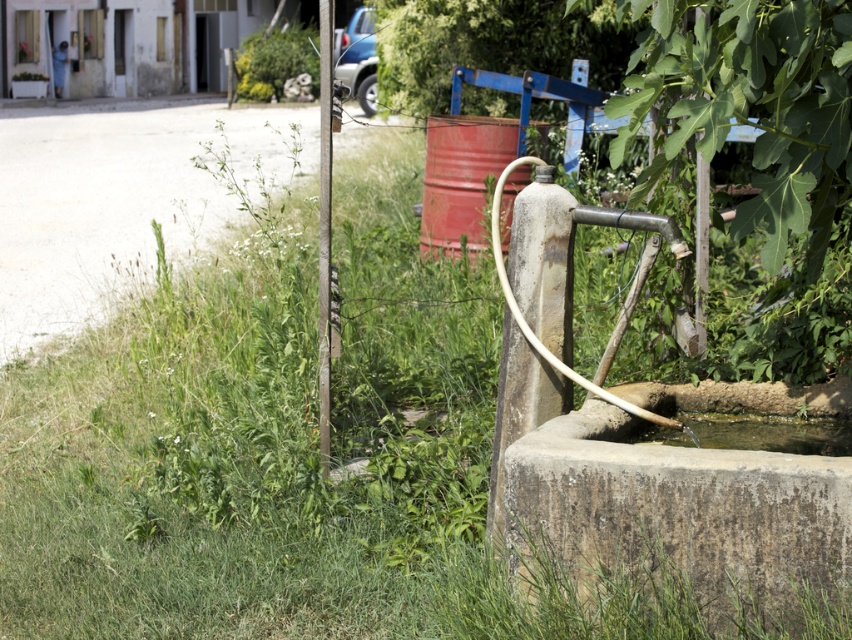
Does gray concrete fountain at lower right appear over rusty metal barrel at center?

No, gray concrete fountain at lower right is not above rusty metal barrel at center.

Does point (617, 522) lie in front of point (430, 170)?

Yes, it is in front of point (430, 170).

Describe the element at coordinates (678, 518) in the screenshot. I see `gray concrete fountain at lower right` at that location.

In order to click on gray concrete fountain at lower right in this screenshot , I will do `click(678, 518)`.

Can you confirm if gray concrete fountain at lower right is thinner than clear water at lower center?

Incorrect, gray concrete fountain at lower right's width is not less than clear water at lower center's.

Measure the distance from gray concrete fountain at lower right to clear water at lower center.

gray concrete fountain at lower right is 15.87 inches away from clear water at lower center.

Measure the distance between point [607,541] and camera.

Point [607,541] is 4.27 meters away from camera.

Find the location of a particular element. gray concrete fountain at lower right is located at coordinates (678, 518).

Does rusty metal barrel at center have a smaller size compared to clear water at lower center?

Actually, rusty metal barrel at center might be larger than clear water at lower center.

Between point (465, 204) and point (802, 419), which one is positioned behind?

The point (465, 204) is more distant.

What are the coordinates of `rusty metal barrel at center` in the screenshot? It's located at (461, 179).